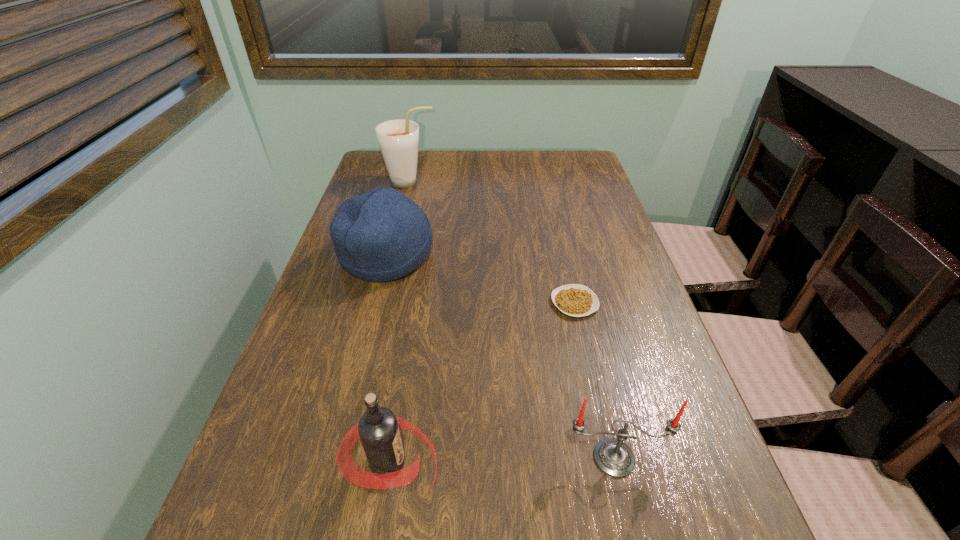
Identify which object is located as the fourth nearest to the skullcap. Please provide its 2D coordinates. Your answer should be formatted as a tuple, i.e. [(x, y)], where the tuple contains the x and y coordinates of a point satisfying the conditions above.

[(613, 457)]

The height and width of the screenshot is (540, 960). Identify the location of object that is the nearest to the farthest object. (381, 235).

This screenshot has width=960, height=540. Find the location of `free spot that satisfies the following two spatial constraints: 1. on the back side of the legume; 2. on the drink side of the tallest object`. free spot that satisfies the following two spatial constraints: 1. on the back side of the legume; 2. on the drink side of the tallest object is located at coordinates (546, 182).